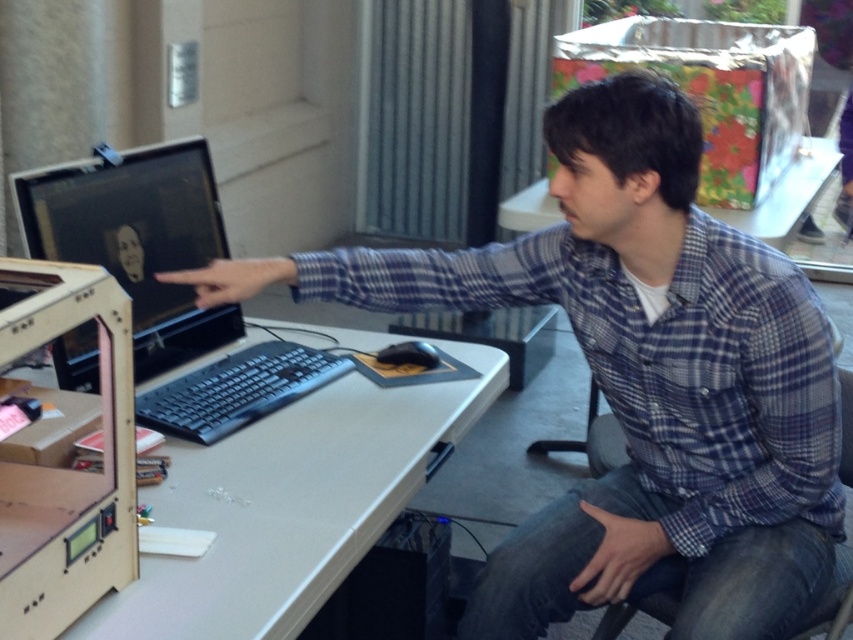
Can you confirm if wooden/plastic 3d printer at lower left is positioned below matte black monitor at left?

Yes.

The image size is (853, 640). In order to click on wooden/plastic 3d printer at lower left in this screenshot , I will do `click(65, 468)`.

The image size is (853, 640). What are the coordinates of `wooden/plastic 3d printer at lower left` in the screenshot? It's located at (65, 468).

Does point (741, 556) come farther from viewer compared to point (152, 401)?

No, it is in front of (152, 401).

This screenshot has height=640, width=853. Find the location of `plaid shirt at center`. plaid shirt at center is located at coordinates [637, 380].

Find the location of a particular element. white matte computer desk at center is located at coordinates (289, 506).

Is white matte computer desk at center taller than matte black monitor at left?

In fact, white matte computer desk at center may be shorter than matte black monitor at left.

The image size is (853, 640). I want to click on white matte computer desk at center, so click(289, 506).

At what (x,y) coordinates should I click in order to perform the action: click on white matte computer desk at center. Please return your answer as a coordinate pair (x, y). The image size is (853, 640). Looking at the image, I should click on (289, 506).